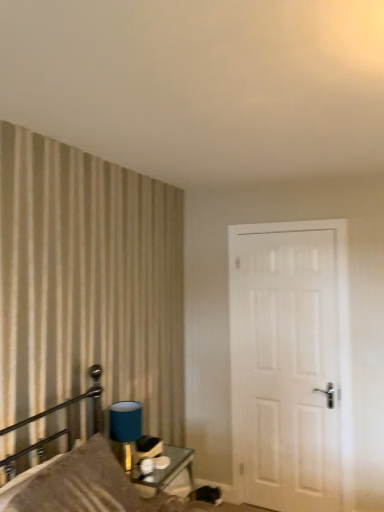
The height and width of the screenshot is (512, 384). Identify the location of free spot below blue fabric lampshade at upper left (from a real-world perspective). (139, 463).